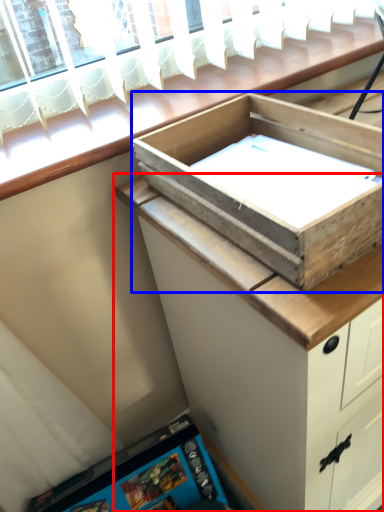
Question: Among these objects, which one is nearest to the camera, cabinetry (highlighted by a red box) or box (highlighted by a blue box)?

Choices:
 (A) cabinetry
 (B) box

Answer: (B)